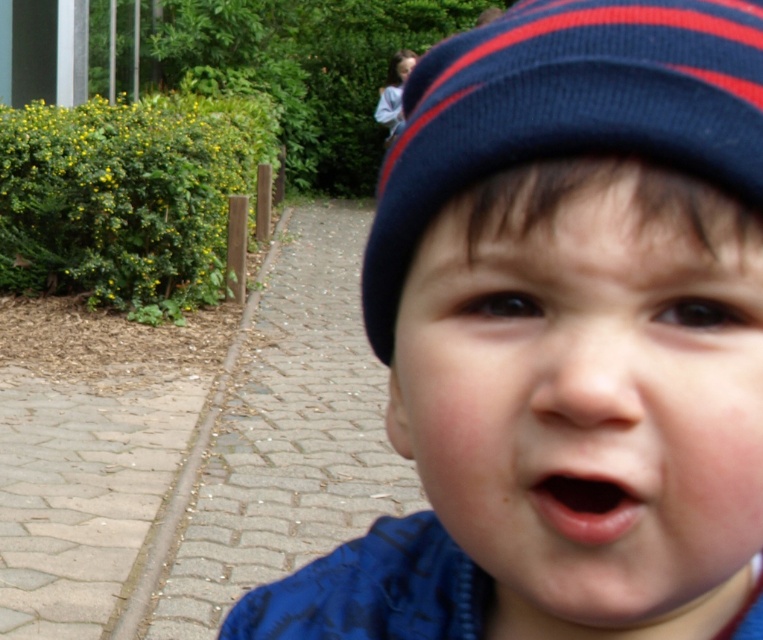
You are a photographer trying to capture both the blue knit hat at center and the blue knit hat at upper right in a single frame. Which hat will appear wider in the photo?

The blue knit hat at center will appear wider in the photo because its width surpasses that of the blue knit hat at upper right.

The child in the image has a blue knit cap at upper center and pink smooth lips at center. Which of these two items is positioned higher on the child?

The blue knit cap at upper center is positioned higher on the child than the pink smooth lips at center.